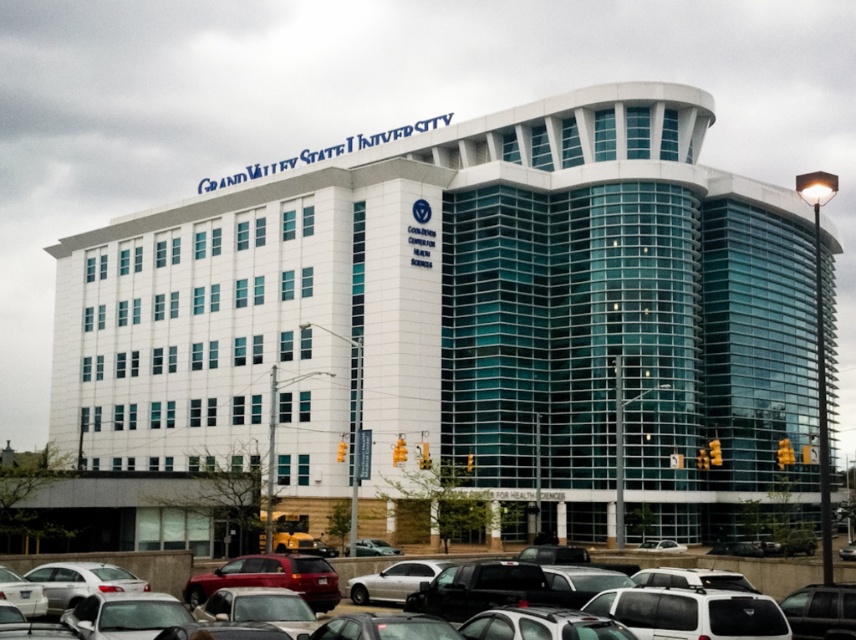
From the picture: You are standing in front of the Grand Valley State University building and see a point at coordinates (271, 577). What object is located at that point?

The point at coordinates (271, 577) corresponds to the matte red suv at center.

You are a delivery driver who needs to park your vehicle in the parking lot near the Grand Valley State University building. You see a matte red suv at center and a metallic silver car at center. Which vehicle is blocking your path to the parking spot?

The matte red suv at center is positioned over the metallic silver car at center, so the matte red suv at center is blocking the path to the parking spot.